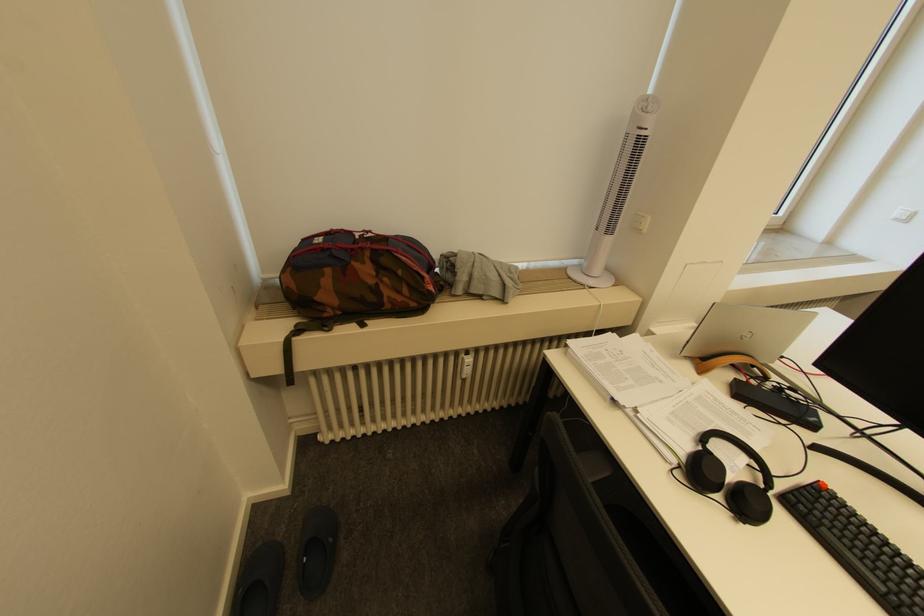
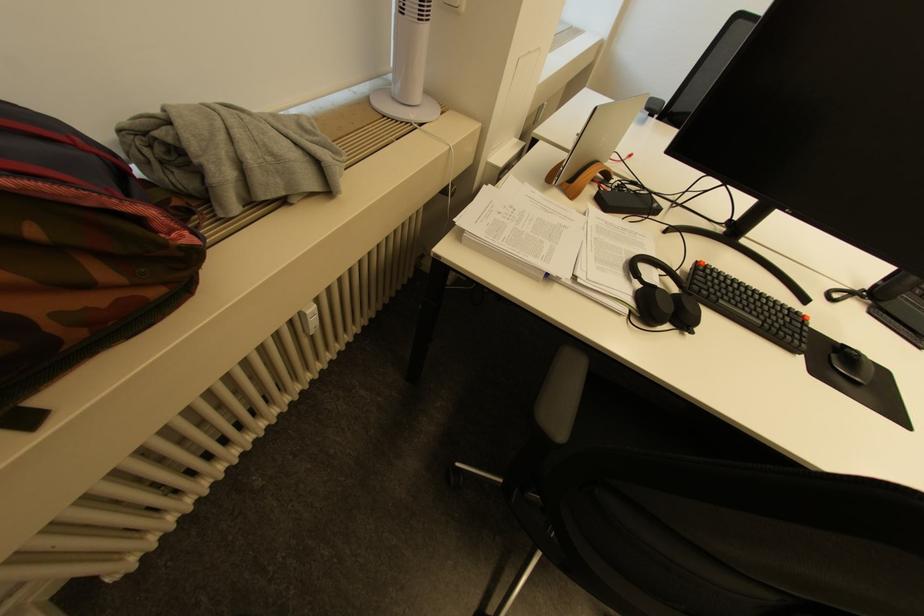
The images are taken continuously from a first-person perspective. In which direction is your viewpoint rotating?

The camera's rotation is toward right-down.